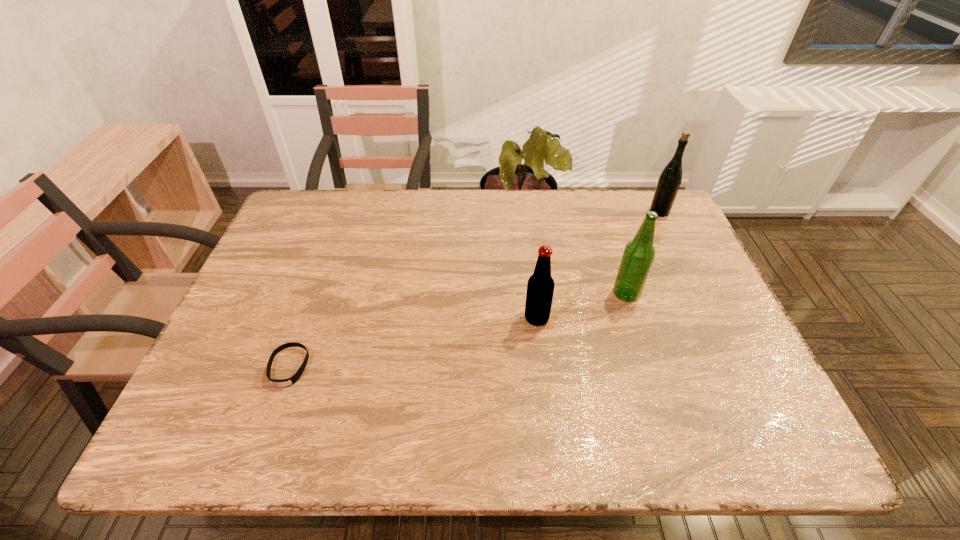
Locate which object is the second closest to the second beer bottle from left to right. Please provide its 2D coordinates. Your answer should be formatted as a tuple, i.e. [(x, y)], where the tuple contains the x and y coordinates of a point satisfying the conditions above.

[(670, 178)]

Identify which object is the third closest to the shortest object. Please provide its 2D coordinates. Your answer should be formatted as a tuple, i.e. [(x, y)], where the tuple contains the x and y coordinates of a point satisfying the conditions above.

[(670, 178)]

At what (x,y) coordinates should I click in order to perform the action: click on the third closest beer bottle to the wristband. Please return your answer as a coordinate pair (x, y). This screenshot has height=540, width=960. Looking at the image, I should click on (670, 178).

Locate an element on the screen. The width and height of the screenshot is (960, 540). beer bottle that is the closest to the rightmost beer bottle is located at coordinates (638, 256).

Find the location of a particular element. The width and height of the screenshot is (960, 540). free space that satisfies the following two spatial constraints: 1. on the label of the second beer bottle from right to left; 2. on the display of the leftmost object is located at coordinates [x=649, y=367].

The height and width of the screenshot is (540, 960). In order to click on free space that satisfies the following two spatial constraints: 1. on the label of the third object from left to right; 2. on the display of the leftmost object in this screenshot , I will do `click(649, 367)`.